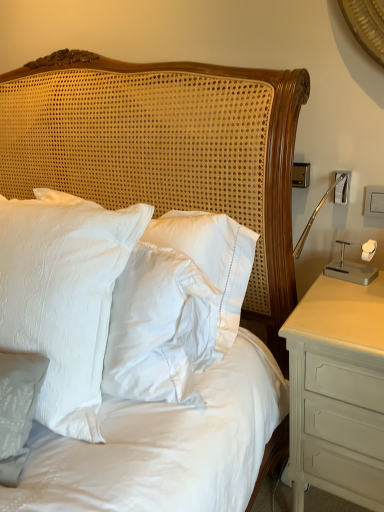
Question: Is white painted wood nightstand at right located outside white satin pillows at center?

Choices:
 (A) yes
 (B) no

Answer: (A)

Question: Is white satin pillows at center completely or partially inside white painted wood nightstand at right?

Choices:
 (A) yes
 (B) no

Answer: (B)

Question: From the image's perspective, is white painted wood nightstand at right located beneath white satin pillows at center?

Choices:
 (A) yes
 (B) no

Answer: (A)

Question: From the image's perspective, is white painted wood nightstand at right on white satin pillows at center?

Choices:
 (A) no
 (B) yes

Answer: (A)

Question: Considering the relative sizes of white painted wood nightstand at right and white satin pillows at center in the image provided, is white painted wood nightstand at right shorter than white satin pillows at center?

Choices:
 (A) no
 (B) yes

Answer: (B)

Question: Considering the relative sizes of white painted wood nightstand at right and white satin pillows at center in the image provided, is white painted wood nightstand at right thinner than white satin pillows at center?

Choices:
 (A) yes
 (B) no

Answer: (B)

Question: Is white satin pillow at center in front of white painted wood nightstand at right?

Choices:
 (A) no
 (B) yes

Answer: (B)

Question: Can you confirm if white satin pillow at center is wider than white painted wood nightstand at right?

Choices:
 (A) no
 (B) yes

Answer: (A)

Question: Is white satin pillow at center thinner than white painted wood nightstand at right?

Choices:
 (A) yes
 (B) no

Answer: (A)

Question: Is white satin pillow at center completely or partially outside of white painted wood nightstand at right?

Choices:
 (A) yes
 (B) no

Answer: (A)

Question: Does white satin pillow at center have a larger size compared to white painted wood nightstand at right?

Choices:
 (A) yes
 (B) no

Answer: (A)

Question: Can white painted wood nightstand at right be found inside white satin pillow at center?

Choices:
 (A) yes
 (B) no

Answer: (B)

Question: From the image's perspective, would you say white satin pillows at center is positioned over white satin pillow at center?

Choices:
 (A) no
 (B) yes

Answer: (B)